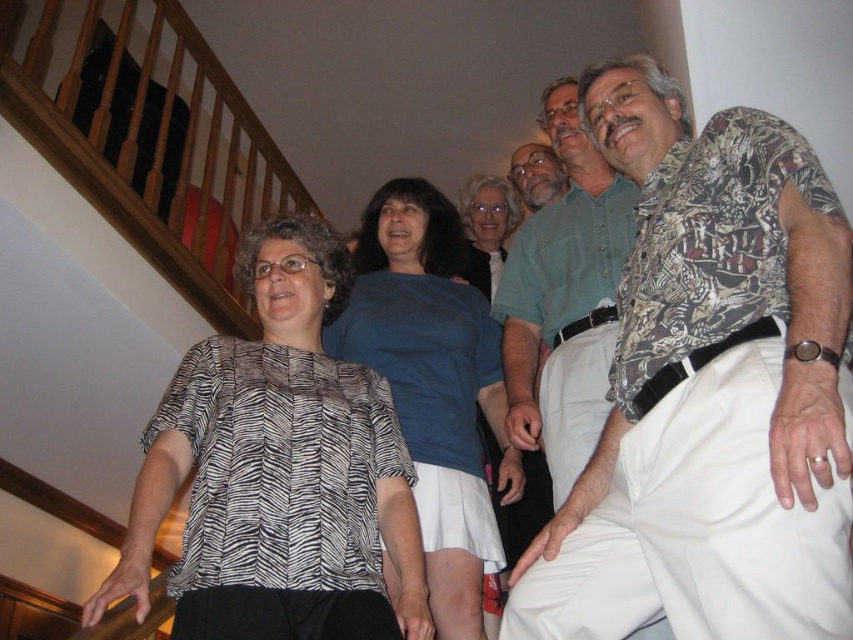
From the picture: You are organizing a photo album and want to ensure the wooden at left and the blue cotton shirt at center are both visible in the image. Which object occupies more space in the photo?

The wooden at left has a larger size compared to the blue cotton shirt at center, so it occupies more space in the photo.

You are trying to decide which shirt to wear for a casual gathering. Based on the image, which of the two shirts, the blue cotton shirt at center or the matte green shirt at upper center, would allow for more comfortable movement due to its width?

The blue cotton shirt at center is wider than the matte green shirt at upper center, so it would allow for more comfortable movement.